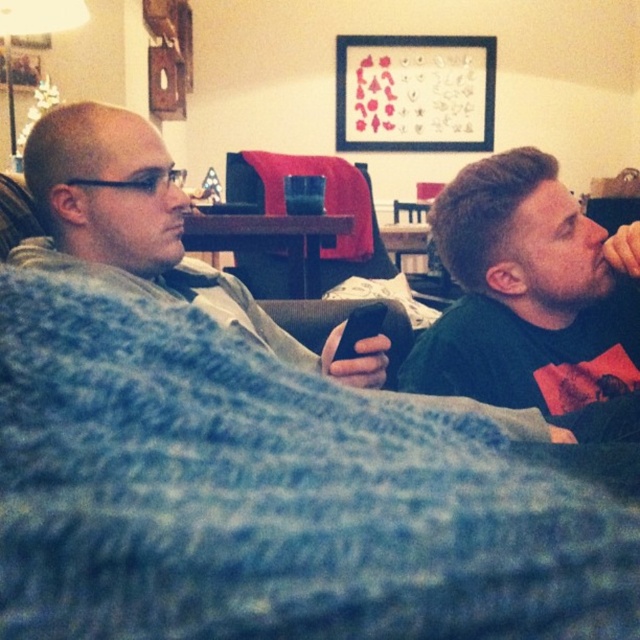
Is point (522, 260) farther from viewer compared to point (88, 141)?

Yes.

How distant is green matte shirt at right from matte gray sweater at left?

green matte shirt at right and matte gray sweater at left are 15.15 inches apart from each other.

This screenshot has width=640, height=640. In order to click on green matte shirt at right in this screenshot , I will do `click(529, 292)`.

Identify the location of green matte shirt at right. This screenshot has height=640, width=640. (529, 292).

Where is `blue knitted blanket at lower left`? The image size is (640, 640). blue knitted blanket at lower left is located at coordinates (268, 497).

How much distance is there between matte gray sweater at left and black plastic remote at center?

matte gray sweater at left is 12.43 inches away from black plastic remote at center.

Is matte gray sweater at left to the left of black plastic remote at center from the viewer's perspective?

Correct, you'll find matte gray sweater at left to the left of black plastic remote at center.

You are a GUI agent. You are given a task and a screenshot of the screen. Output one action in this format:
    pyautogui.click(x=<x>, y=<y>)
    Task: Click on the matte gray sweater at left
    This screenshot has height=640, width=640.
    Given the screenshot: What is the action you would take?
    pyautogui.click(x=147, y=228)